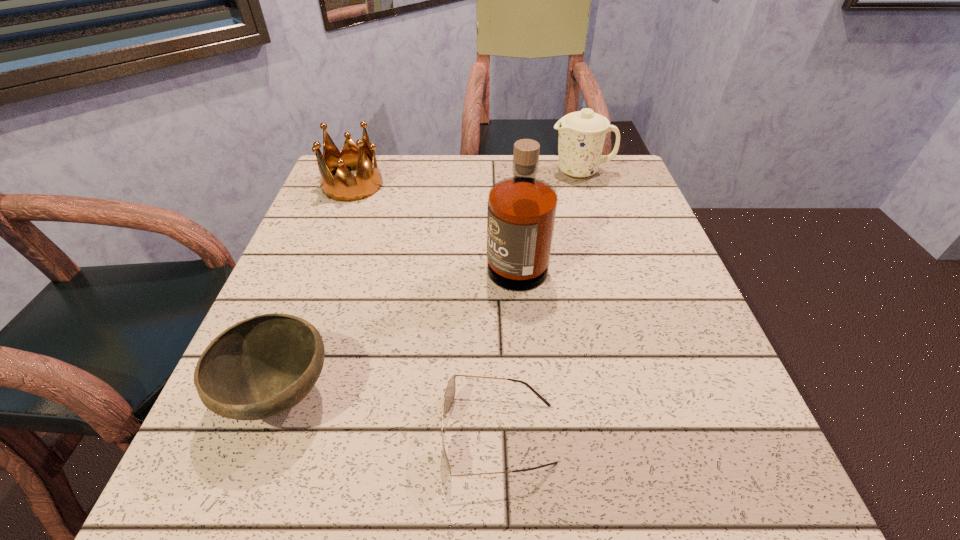
This screenshot has width=960, height=540. What are the coordinates of `liquor` in the screenshot? It's located at (521, 212).

You are a GUI agent. You are given a task and a screenshot of the screen. Output one action in this format:
    pyautogui.click(x=<x>, y=<y>)
    Task: Click on the tallest object
    Image resolution: width=960 pixels, height=540 pixels.
    Given the screenshot: What is the action you would take?
    pyautogui.click(x=521, y=212)

Locate an element on the screen. chinaware is located at coordinates (581, 137).

Locate an element on the screen. The width and height of the screenshot is (960, 540). crown is located at coordinates (344, 186).

What are the coordinates of `the fourth tallest object` in the screenshot? It's located at (260, 367).

The width and height of the screenshot is (960, 540). Identify the location of sunglasses. (449, 395).

This screenshot has width=960, height=540. I want to click on free space located on the front label of the liquor, so click(x=347, y=255).

You are a GUI agent. You are given a task and a screenshot of the screen. Output one action in this format:
    pyautogui.click(x=<x>, y=<y>)
    Task: Click on the vacant space located 0.140m on the front label of the liquor
    Image resolution: width=960 pixels, height=540 pixels.
    Given the screenshot: What is the action you would take?
    tap(421, 255)

I want to click on vacant position located 0.120m on the front label of the liquor, so click(430, 255).

Identify the location of free location located on the spout of the chinaware. The height and width of the screenshot is (540, 960). (401, 172).